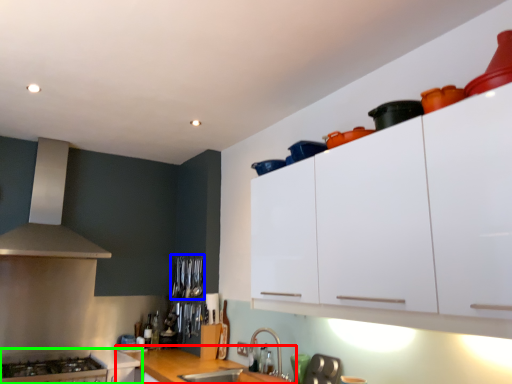
Question: Estimate the real-world distances between objects in this image. Which object is closer to countertop (highlighted by a red box), appliance (highlighted by a blue box) or cabinetry (highlighted by a green box)?

Choices:
 (A) appliance
 (B) cabinetry

Answer: (B)